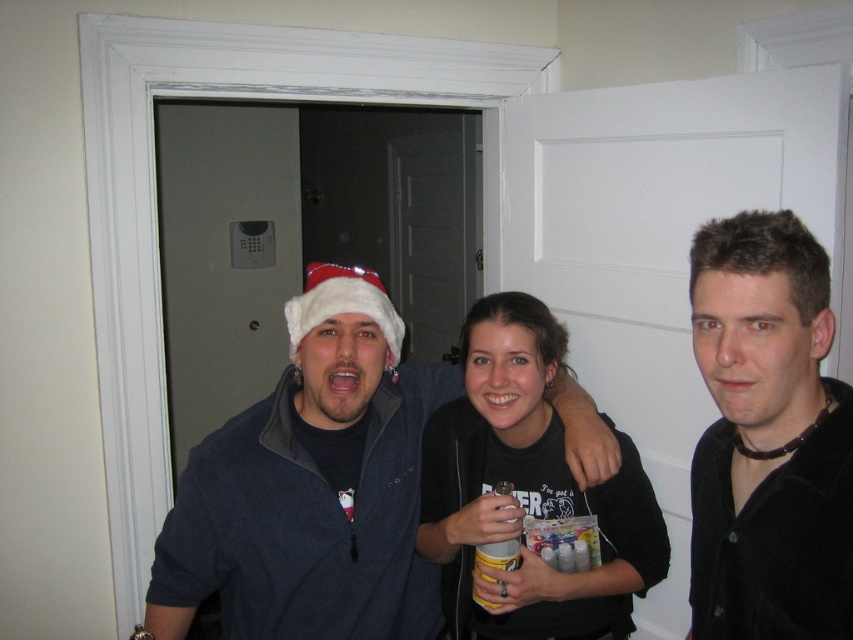
Does point (705, 378) come in front of point (442, 589)?

That is True.

Does black velvet shirt at center have a greater height compared to black matte shirt at center?

In fact, black velvet shirt at center may be shorter than black matte shirt at center.

At what (x,y) coordinates should I click in order to perform the action: click on black velvet shirt at center. Please return your answer as a coordinate pair (x, y). Looking at the image, I should click on (769, 436).

Between dark blue fleece jacket at center and black matte shirt at center, which one appears on the right side from the viewer's perspective?

black matte shirt at center

Is dark blue fleece jacket at center above black matte shirt at center?

Yes, dark blue fleece jacket at center is above black matte shirt at center.

Locate an element on the screen. This screenshot has width=853, height=640. dark blue fleece jacket at center is located at coordinates (311, 486).

What do you see at coordinates (311, 486) in the screenshot? I see `dark blue fleece jacket at center` at bounding box center [311, 486].

Is dark blue fleece jacket at center bigger than black velvet shirt at center?

Yes.

Where is `dark blue fleece jacket at center`? dark blue fleece jacket at center is located at coordinates (311, 486).